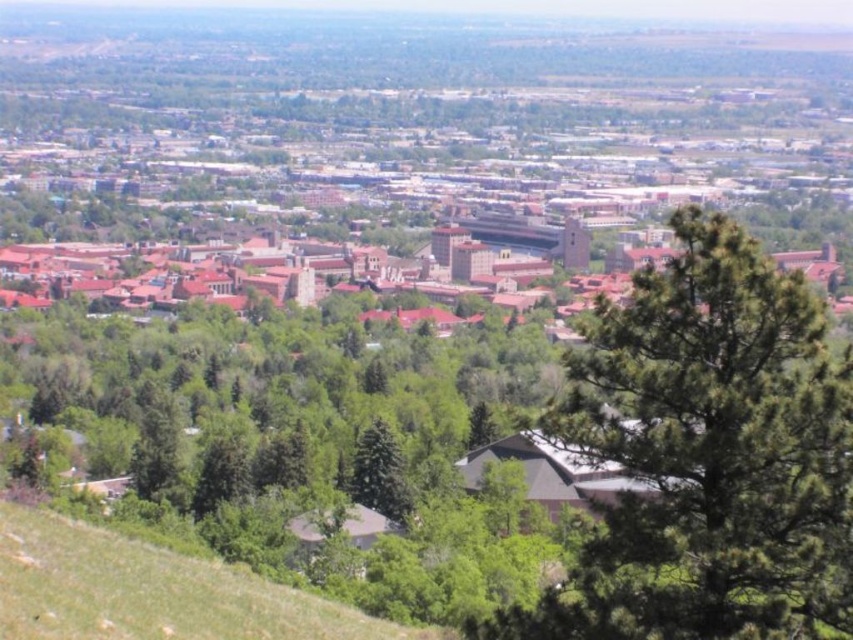
Consider the image. You are a city planner reviewing this urban landscape. You need to determine which area occupies more horizontal space in the image between the green grassy hillside at lower left and the green matte tree at center. Which one is wider?

The green grassy hillside at lower left is wider than the green matte tree at center, as its width is larger according to the description.

You are standing at the vantage point overlooking the city and want to take a photo. There are two points of interest marked as point 1 at coordinates [672,532] and point 2 at coordinates [42,588]. Which point is closer to your current position?

Point 1 at coordinates [672,532] is closer to your current position because it is further to the camera than point 2 at coordinates [42,588].

You are standing on the hillside overlooking the city and notice two trees at the center of the image. One is labeled as the green leafy tree at center and the other as the green matte tree at center. From your vantage point, which tree is positioned to the right?

The green leafy tree at center is positioned to the right of the green matte tree at center.